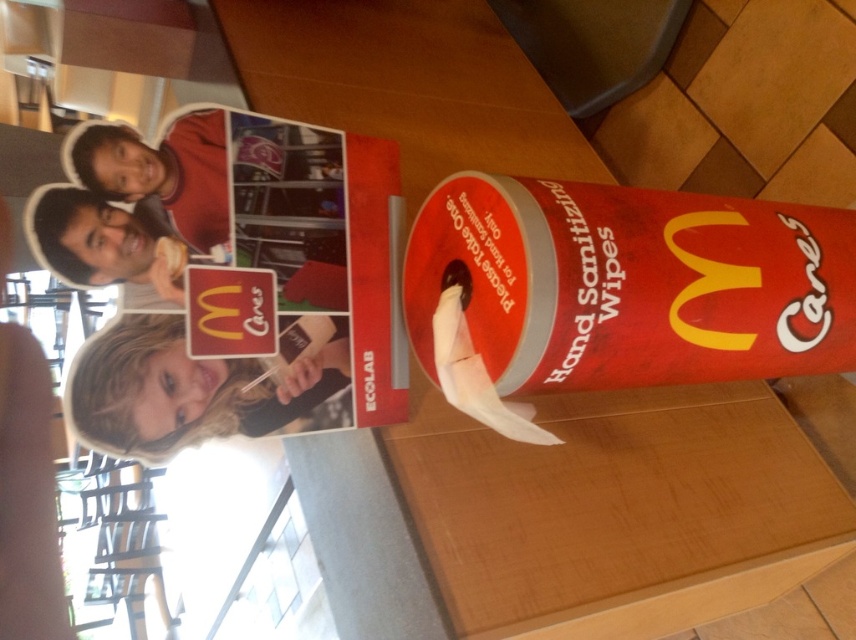
You are a customer looking at the promotional advertisement and notice two items at the upper left corner. Which one is positioned lower between the matte cardboard magazine at upper left and the matte red shirt at upper left?

The matte cardboard magazine at upper left is positioned lower than the matte red shirt at upper left.